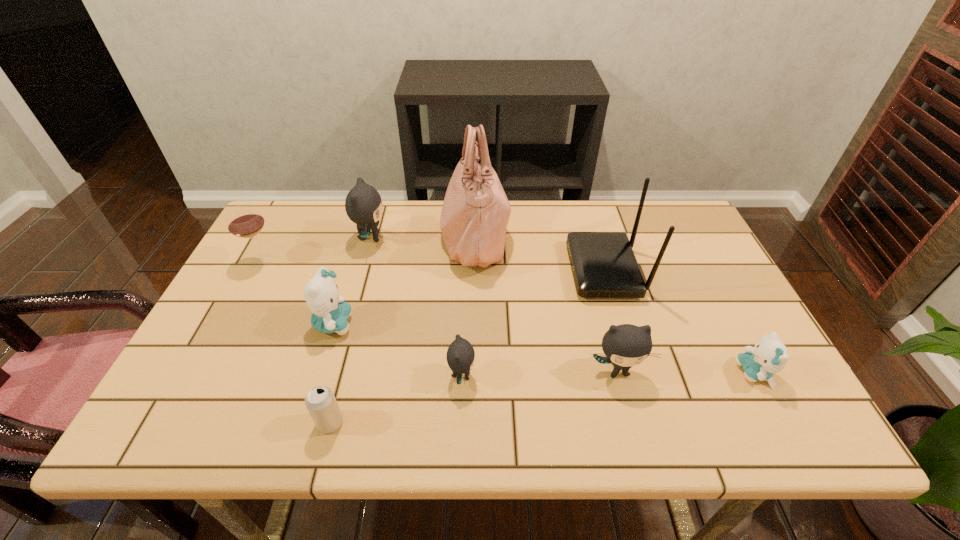
You are a GUI agent. You are given a task and a screenshot of the screen. Output one action in this format:
    pyautogui.click(x=<x>, y=<y>)
    Task: Click on the router that is at the far edge
    The width and height of the screenshot is (960, 540).
    Given the screenshot: What is the action you would take?
    pyautogui.click(x=603, y=264)

Locate an element on the screen. kitten located in the far edge section of the desktop is located at coordinates (363, 205).

Identify the location of object located at the near edge. The width and height of the screenshot is (960, 540). (320, 401).

This screenshot has height=540, width=960. What are the coordinates of `object located at the left edge` in the screenshot? It's located at (245, 221).

You are a GUI agent. You are given a task and a screenshot of the screen. Output one action in this format:
    pyautogui.click(x=<x>, y=<y>)
    Task: Click on the object at the right edge
    The width and height of the screenshot is (960, 540).
    Given the screenshot: What is the action you would take?
    pyautogui.click(x=769, y=356)

This screenshot has height=540, width=960. In order to click on blank space at the far edge in this screenshot , I will do `click(544, 205)`.

In the image, there is a desktop. Where is `free region at the near edge`? free region at the near edge is located at coordinates (373, 421).

Find the location of a particular element. The image size is (960, 540). free location at the left edge of the desktop is located at coordinates pyautogui.click(x=214, y=373).

In the image, there is a desktop. Where is `vacant space at the right edge`? vacant space at the right edge is located at coordinates (722, 285).

Find the location of a particular element. The image size is (960, 540). free space at the near left corner is located at coordinates (173, 434).